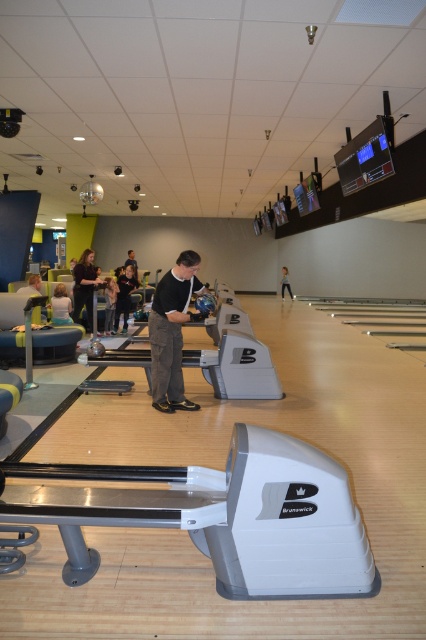
Can you confirm if dark brown leather jacket at left is positioned to the right of dark gray pants at center?

No, dark brown leather jacket at left is not to the right of dark gray pants at center.

Between dark brown leather jacket at left and dark gray pants at center, which one is positioned higher?

Positioned higher is dark gray pants at center.

Is point (85, 256) closer to camera compared to point (137, 280)?

Yes, point (85, 256) is in front of point (137, 280).

Image resolution: width=426 pixels, height=640 pixels. Identify the location of dark brown leather jacket at left. (85, 285).

Can you confirm if dark gray pants at center is smaller than black leather bowling shoes at center?

No, dark gray pants at center is not smaller than black leather bowling shoes at center.

Does point (126, 280) come behind point (115, 305)?

That is False.

Is point (132, 284) closer to viewer compared to point (106, 326)?

That is False.

Find the location of a particular element. The width and height of the screenshot is (426, 640). dark gray pants at center is located at coordinates (124, 296).

Between point (62, 308) and point (111, 280), which one is positioned behind?

Positioned behind is point (111, 280).

The width and height of the screenshot is (426, 640). Find the location of `light gray shirt at center`. light gray shirt at center is located at coordinates (60, 305).

Between point (51, 298) and point (108, 285), which one is positioned behind?

The point (51, 298) is behind.

Where is `light gray shirt at center`? light gray shirt at center is located at coordinates (60, 305).